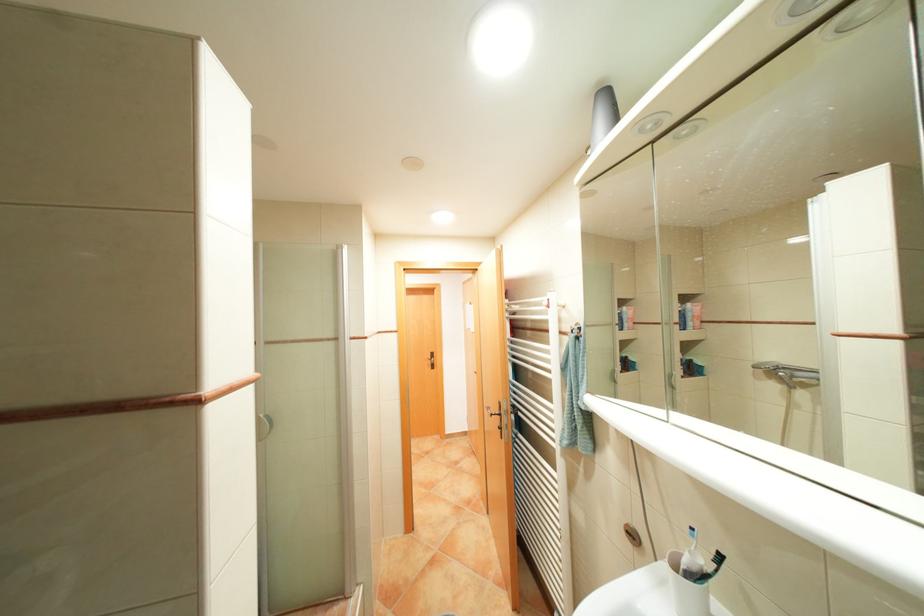
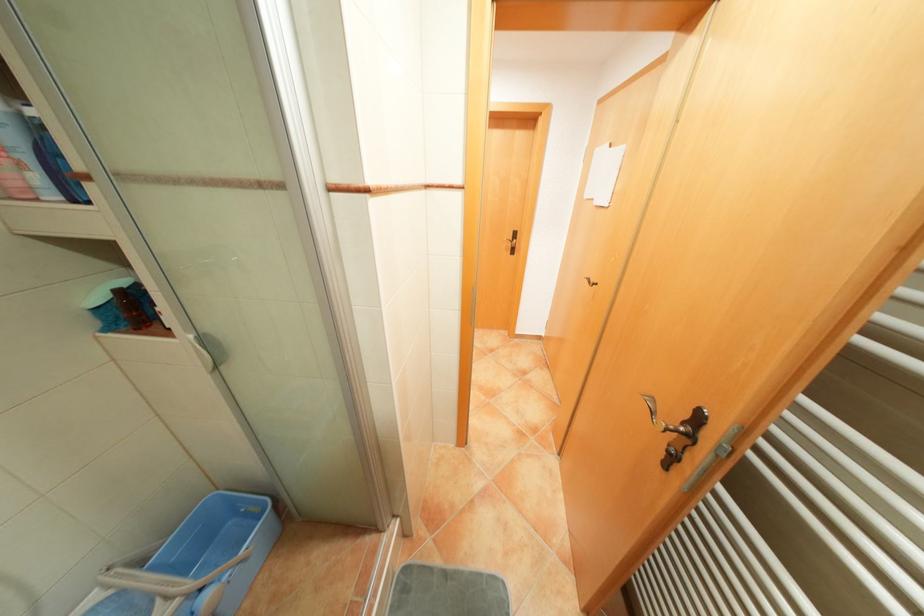
Consider the image. The images are taken continuously from a first-person perspective. In which direction is your viewpoint rotating?

The camera's rotation is toward left-down.